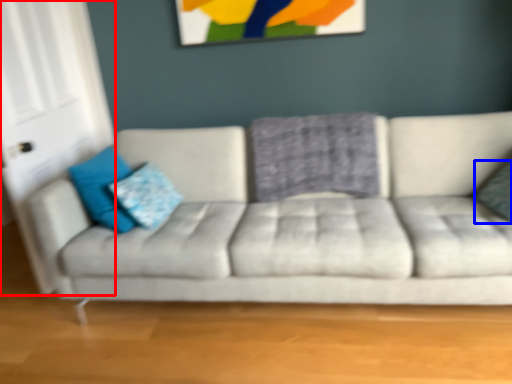
Question: Which point is further to the camera, glass door (highlighted by a red box) or pillow (highlighted by a blue box)?

Choices:
 (A) glass door
 (B) pillow

Answer: (A)